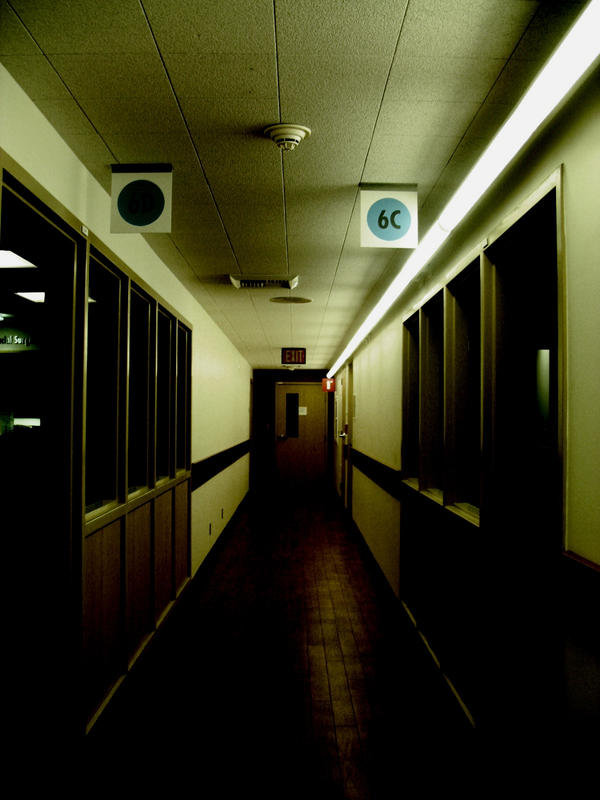
Find the location of `brown floor`. brown floor is located at coordinates (336, 617).